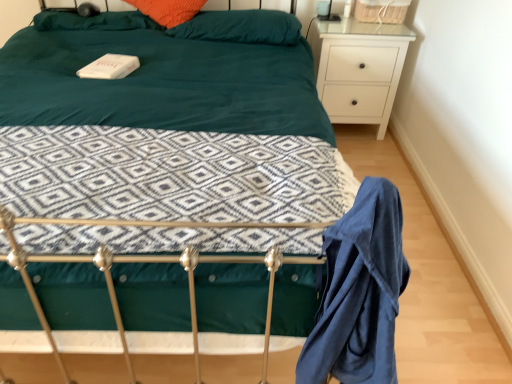
Question: Can you confirm if teal fabric bed at center is smaller than orange fabric pillow at upper center, which is the second pillow from right to left?

Choices:
 (A) yes
 (B) no

Answer: (B)

Question: Is teal fabric bed at center thinner than orange fabric pillow at upper center, the 1th pillow viewed from the left?

Choices:
 (A) no
 (B) yes

Answer: (A)

Question: Considering the relative sizes of teal fabric bed at center and orange fabric pillow at upper center, which is the second pillow from right to left, in the image provided, is teal fabric bed at center taller than orange fabric pillow at upper center, which is the second pillow from right to left,?

Choices:
 (A) no
 (B) yes

Answer: (B)

Question: Would you say teal fabric bed at center contains orange fabric pillow at upper center, the 1th pillow viewed from the left?

Choices:
 (A) no
 (B) yes

Answer: (B)

Question: Is teal fabric bed at center shorter than orange fabric pillow at upper center, the 1th pillow viewed from the left?

Choices:
 (A) no
 (B) yes

Answer: (A)

Question: Can you confirm if teal fabric bed at center is wider than orange fabric pillow at upper center, which is the second pillow from right to left?

Choices:
 (A) yes
 (B) no

Answer: (A)

Question: Is white matte nightstand at upper right positioned behind orange fabric pillow at upper center, which is the second pillow from right to left?

Choices:
 (A) no
 (B) yes

Answer: (B)

Question: Does white matte nightstand at upper right contain orange fabric pillow at upper center, the 1th pillow viewed from the left?

Choices:
 (A) no
 (B) yes

Answer: (A)

Question: Does white matte nightstand at upper right have a lesser height compared to orange fabric pillow at upper center, which is the second pillow from right to left?

Choices:
 (A) no
 (B) yes

Answer: (A)

Question: From the image's perspective, is white matte nightstand at upper right on top of orange fabric pillow at upper center, the 1th pillow viewed from the left?

Choices:
 (A) no
 (B) yes

Answer: (A)

Question: Could you tell me if white matte nightstand at upper right is facing orange fabric pillow at upper center, the 1th pillow viewed from the left?

Choices:
 (A) no
 (B) yes

Answer: (A)

Question: Considering the relative sizes of white matte nightstand at upper right and orange fabric pillow at upper center, which is the second pillow from right to left, in the image provided, is white matte nightstand at upper right smaller than orange fabric pillow at upper center, which is the second pillow from right to left,?

Choices:
 (A) no
 (B) yes

Answer: (A)

Question: Is blue cotton robe at lower right wider than teal fabric bed at center?

Choices:
 (A) no
 (B) yes

Answer: (A)